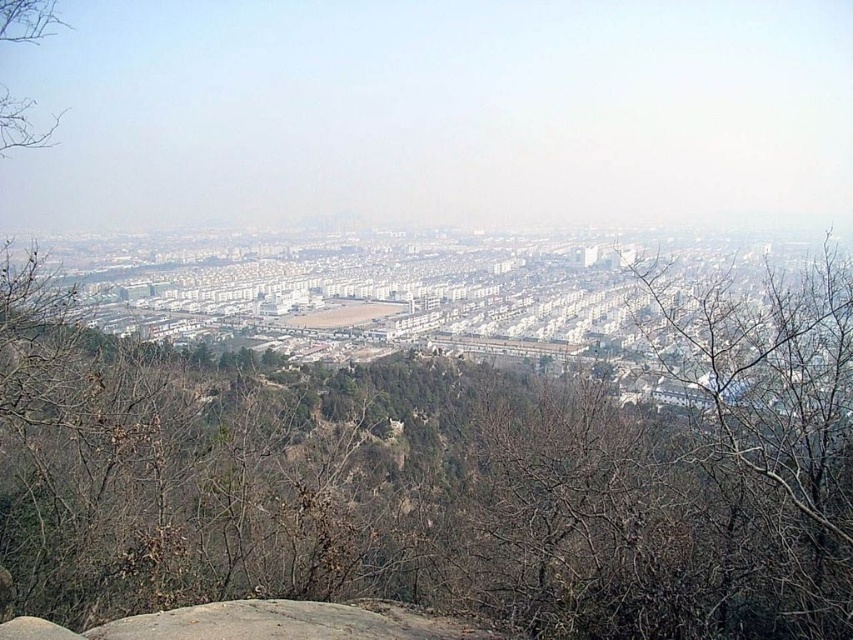
Question: Is brown leafless tree at center to the left of gray rough rock at center from the viewer's perspective?

Choices:
 (A) no
 (B) yes

Answer: (A)

Question: Which of the following is the farthest from the observer?

Choices:
 (A) (242, 611)
 (B) (577, 483)

Answer: (B)

Question: Does brown leafless tree at center have a greater width compared to gray rough rock at center?

Choices:
 (A) no
 (B) yes

Answer: (B)

Question: Which object is closer to the camera taking this photo?

Choices:
 (A) gray rough rock at center
 (B) brown leafless tree at center

Answer: (A)

Question: In this image, where is brown leafless tree at center located relative to gray rough rock at center?

Choices:
 (A) left
 (B) right

Answer: (B)

Question: Among these points, which one is farthest from the camera?

Choices:
 (A) (204, 604)
 (B) (62, 604)

Answer: (A)